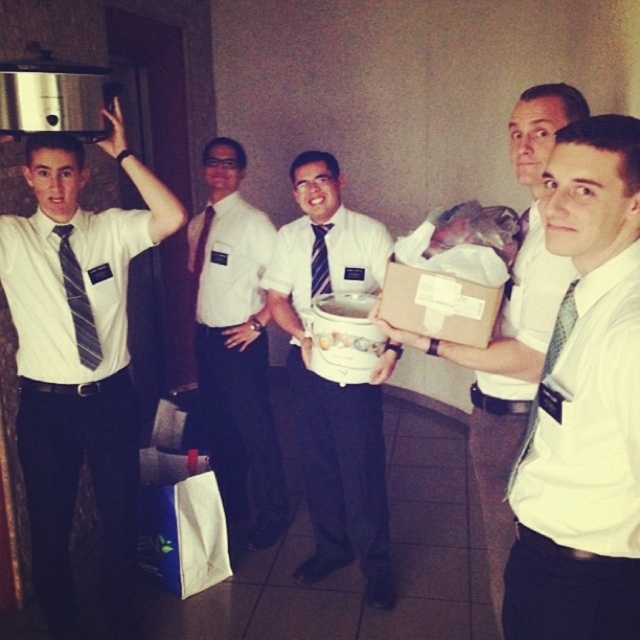
Question: Which object is the closest to the matte white bucket at center?

Choices:
 (A) matte black tie at center
 (B) striped fabric tie at left
 (C) matte black tie at upper left
 (D) green textured tie at right

Answer: (C)

Question: In this image, where is green textured tie at right located relative to blue striped tie at center?

Choices:
 (A) left
 (B) right

Answer: (B)

Question: Is matte white box at center thinner than matte black tie at center?

Choices:
 (A) yes
 (B) no

Answer: (B)

Question: Which point is farther from the camera taking this photo?

Choices:
 (A) (410, 289)
 (B) (317, 243)

Answer: (B)

Question: Which object appears closest to the camera in this image?

Choices:
 (A) matte white box at center
 (B) white shirt at center

Answer: (A)

Question: Is white shirt at center further to the viewer compared to green textured tie at right?

Choices:
 (A) no
 (B) yes

Answer: (B)